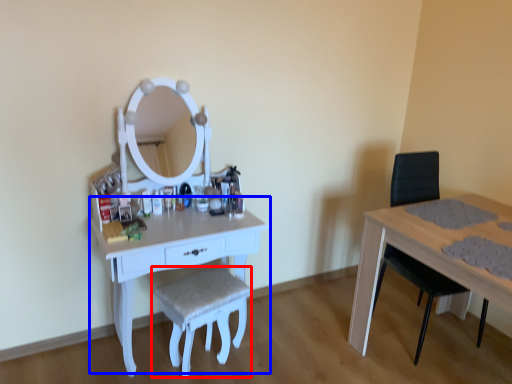
Question: Among these objects, which one is farthest to the camera, stool (highlighted by a red box) or table (highlighted by a blue box)?

Choices:
 (A) stool
 (B) table

Answer: (A)